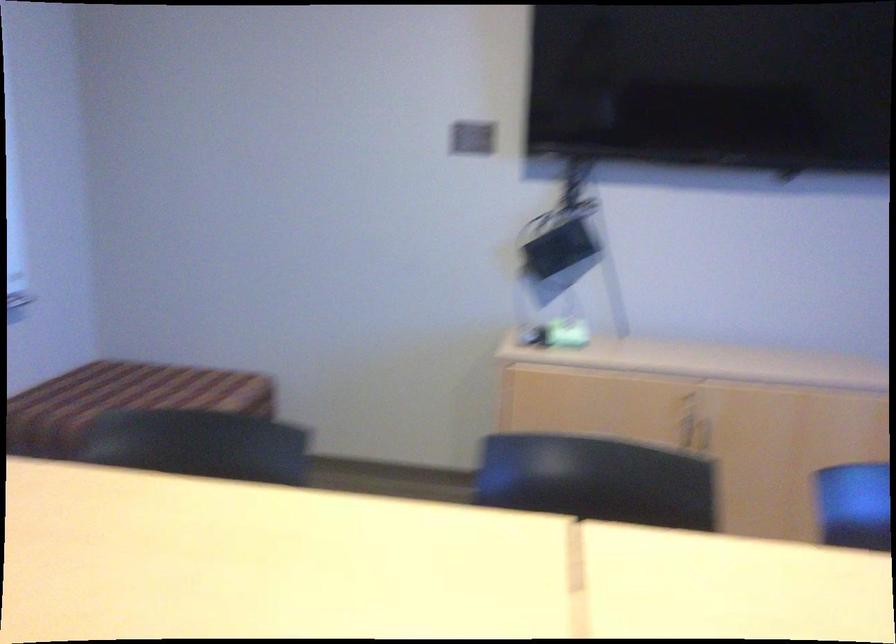
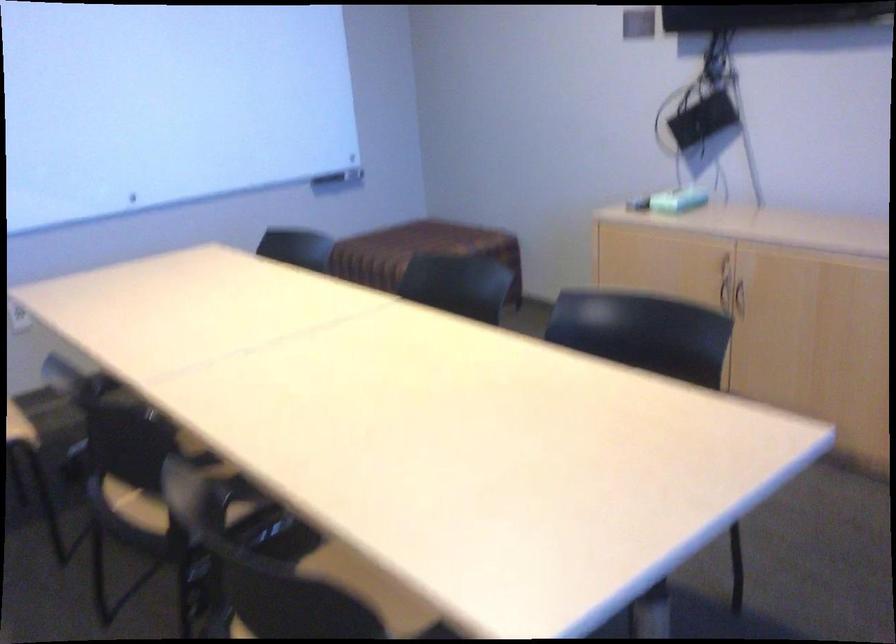
Find the pixel in the second image that matches [561,333] in the first image.

(677, 200)